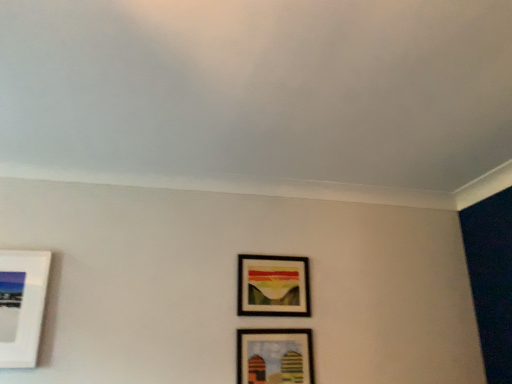
Question: From the image's perspective, is wooden framed artwork at center, the 2th picture frame in the bottom-to-top sequence, above or below wooden framed picture at lower center, positioned as the 1th picture frame in bottom-to-top order?

Choices:
 (A) above
 (B) below

Answer: (A)

Question: In terms of width, does wooden framed artwork at center, the 2th picture frame in the bottom-to-top sequence, look wider or thinner when compared to wooden framed picture at lower center, which appears as the second picture frame when viewed from the top?

Choices:
 (A) thin
 (B) wide

Answer: (B)

Question: Is wooden framed artwork at center, positioned as the first picture frame in top-to-bottom order, spatially inside wooden framed picture at lower center, which appears as the second picture frame when viewed from the top, or outside of it?

Choices:
 (A) inside
 (B) outside

Answer: (B)

Question: Is point (261, 354) closer or farther from the camera than point (300, 314)?

Choices:
 (A) farther
 (B) closer

Answer: (B)

Question: From a real-world perspective, is wooden framed picture at lower center, positioned as the 1th picture frame in bottom-to-top order, physically located above or below wooden framed artwork at center, positioned as the first picture frame in top-to-bottom order?

Choices:
 (A) below
 (B) above

Answer: (A)

Question: Is wooden framed picture at lower center, positioned as the 1th picture frame in bottom-to-top order, in front of or behind wooden framed artwork at center, positioned as the first picture frame in top-to-bottom order, in the image?

Choices:
 (A) behind
 (B) front

Answer: (B)

Question: Based on their sizes in the image, would you say wooden framed picture at lower center, which appears as the second picture frame when viewed from the top, is bigger or smaller than wooden framed artwork at center, positioned as the first picture frame in top-to-bottom order?

Choices:
 (A) small
 (B) big

Answer: (A)